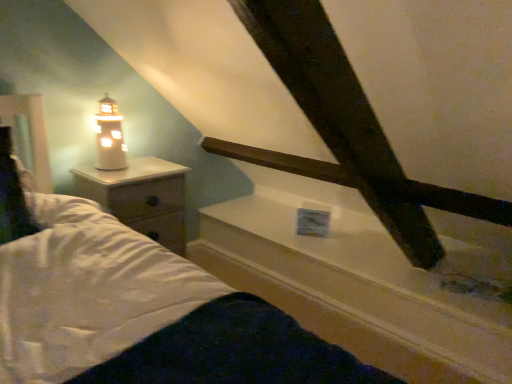
The width and height of the screenshot is (512, 384). Identify the location of vacant space to the right of white ceramic lighthouse at left. (151, 174).